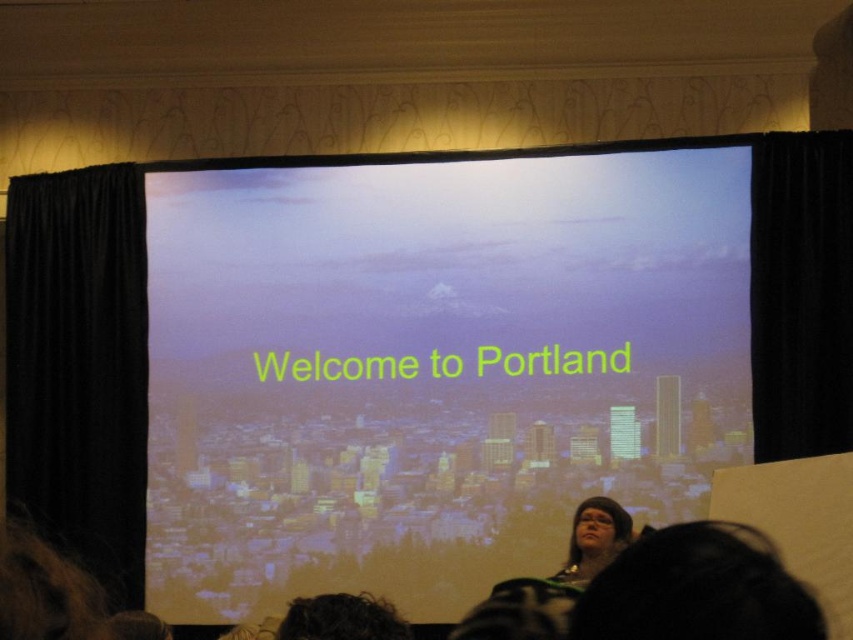
You are a photographer standing at the camera position in the presentation setting. You want to take a closeup shot of the matte screen at center. Considering the distance between you and the screen, is it advisable to use a standard lens with a focal length of 50mm or a telephoto lens with a focal length of 200mm? Explain your choice based on the distance provided.

The matte screen at center is 18.16 feet away from the camera. A telephoto lens with a focal length of 200mm would be more advisable because it allows for a closer, zoomed view of the screen from that distance, whereas a standard 50mm lens might capture too wide an angle, including more of the surroundings and less detail of the screen itself.

You are organizing a presentation and need to ensure that the black velvet curtain at left and the matte black glasses at lower center are both visible to the audience. Since the screen is at the back, which object is wider and might block more of the presenter?

The black velvet curtain at left is wider than the matte black glasses at lower center, so it might block more of the presenter.